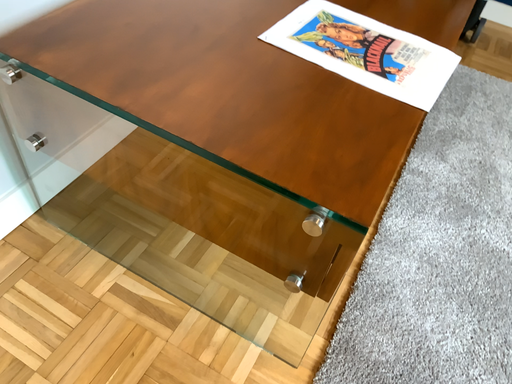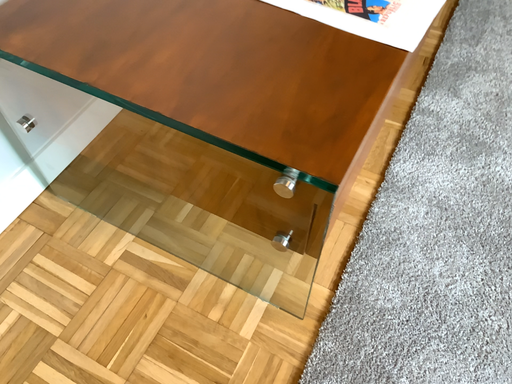
Question: Which way did the camera rotate in the video?

Choices:
 (A) rotated downward
 (B) rotated upward

Answer: (A)